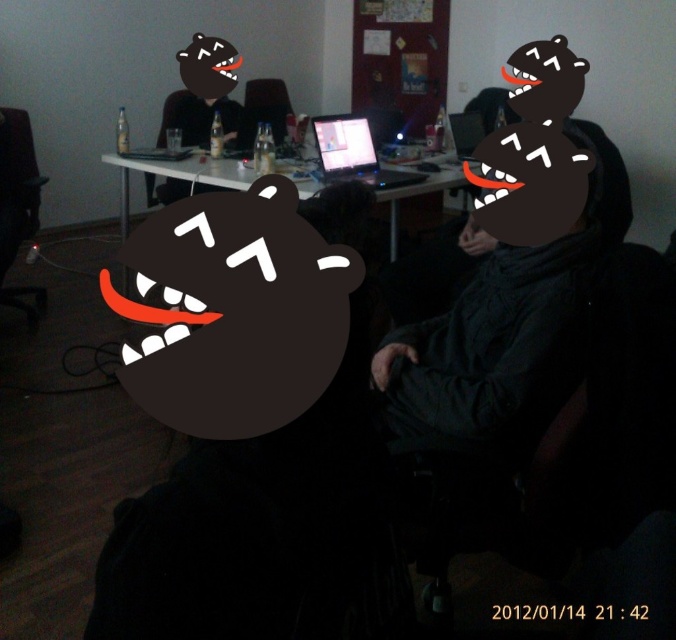
Based on the photo, is matte black laptop at upper center above matte black laptop at center?

Yes, matte black laptop at upper center is above matte black laptop at center.

Does matte black laptop at upper center have a lesser width compared to matte black laptop at center?

No.

Is point (208, 132) positioned behind point (358, 163)?

Yes, point (208, 132) is behind point (358, 163).

The width and height of the screenshot is (676, 640). I want to click on matte black laptop at upper center, so click(x=206, y=92).

Does black plastic chair at left appear over matte plastic laptop at center?

Actually, black plastic chair at left is below matte plastic laptop at center.

Is point (14, 184) positioned after point (331, 134)?

Yes, it is.

Find the location of `black plastic chair at left`. black plastic chair at left is located at coordinates (18, 209).

Where is `matte black laptop at upper center`? matte black laptop at upper center is located at coordinates (206, 92).

Is matte black laptop at upper center bigger than matte plastic laptop at center?

Yes, matte black laptop at upper center is bigger than matte plastic laptop at center.

Where is `matte black laptop at upper center`? This screenshot has height=640, width=676. matte black laptop at upper center is located at coordinates (206, 92).